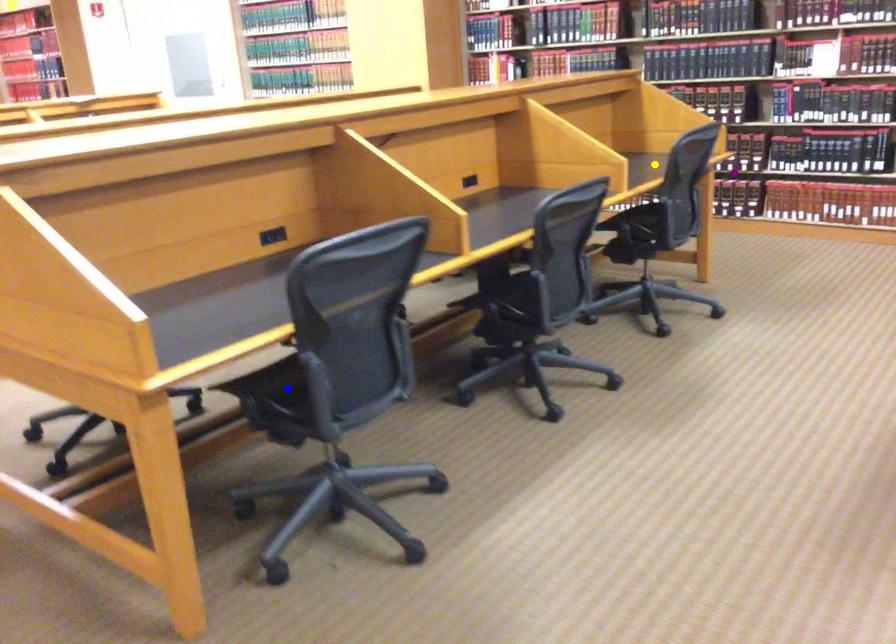
Order these from nearest to farthest:
yellow point | blue point | purple point

1. purple point
2. yellow point
3. blue point